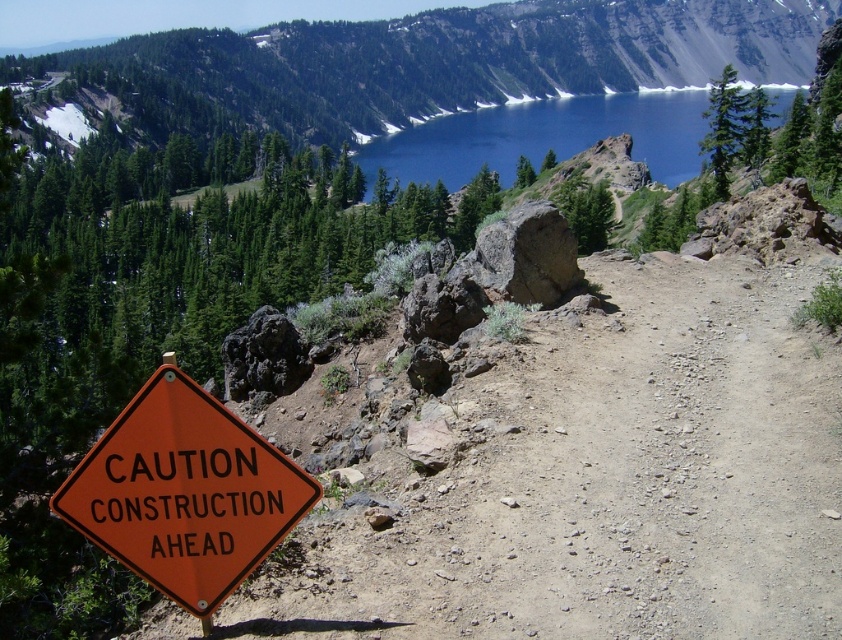
Question: Can you confirm if orange plastic sign at lower left is positioned below blue glassy lake at upper center?

Choices:
 (A) yes
 (B) no

Answer: (A)

Question: Does orange plastic sign at lower left have a smaller size compared to blue glassy lake at upper center?

Choices:
 (A) no
 (B) yes

Answer: (B)

Question: Which object appears closest to the camera in this image?

Choices:
 (A) blue glassy lake at upper center
 (B) orange plastic sign at lower left

Answer: (B)

Question: Does orange plastic sign at lower left come in front of blue glassy lake at upper center?

Choices:
 (A) no
 (B) yes

Answer: (B)